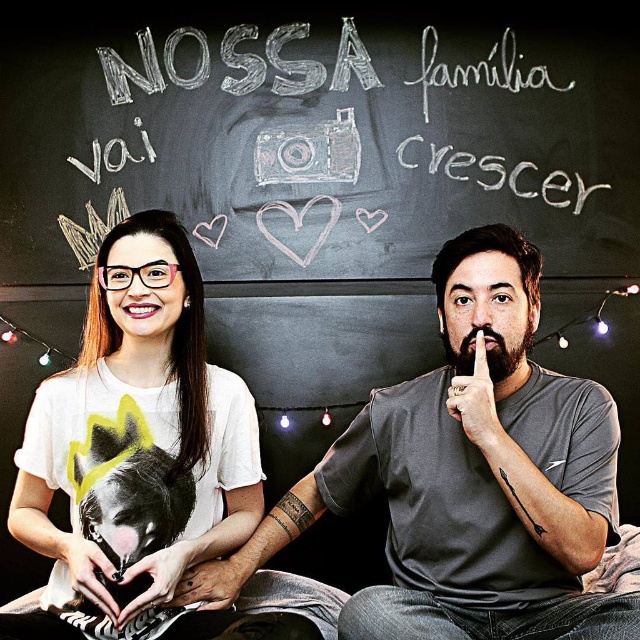
Between point (556, 445) and point (76, 525), which one is positioned in front?

Point (76, 525)

Is gray matte t-shirt at center closer to camera compared to white matte t-shirt at left?

Yes, gray matte t-shirt at center is closer to the viewer.

What do you see at coordinates (468, 476) in the screenshot?
I see `gray matte t-shirt at center` at bounding box center [468, 476].

What are the coordinates of `gray matte t-shirt at center` in the screenshot? It's located at (468, 476).

Is black chalkboard at upper center thinner than white matte t-shirt at left?

No.

Who is more forward, (321,205) or (164,268)?

Positioned in front is point (164,268).

Between point (67, 204) and point (83, 380), which one is positioned in front?

Point (83, 380)

The image size is (640, 640). What are the coordinates of `black chalkboard at upper center` in the screenshot? It's located at (324, 136).

Who is shorter, black chalkboard at upper center or gray matte t-shirt at center?

Standing shorter between the two is black chalkboard at upper center.

Measure the distance from black chalkboard at upper center to gray matte t-shirt at center.

They are 32.16 inches apart.

Which is behind, point (372, 22) or point (444, 387)?

Point (372, 22)

At what (x,y) coordinates should I click in order to perform the action: click on black chalkboard at upper center. Please return your answer as a coordinate pair (x, y). Looking at the image, I should click on (324, 136).